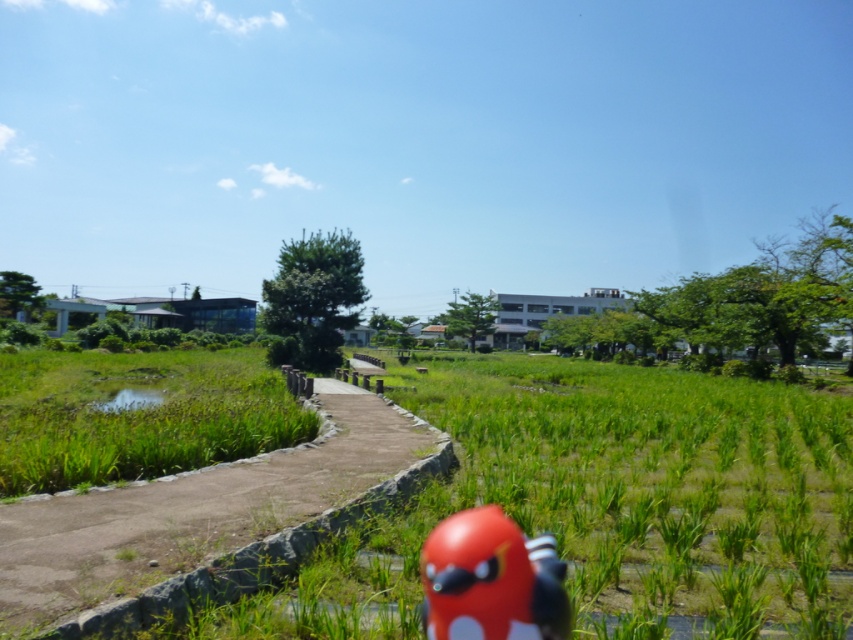
Question: Is smooth concrete path at center smaller than shiny red toy at center?

Choices:
 (A) no
 (B) yes

Answer: (A)

Question: Among these points, which one is nearest to the camera?

Choices:
 (A) (55, 570)
 (B) (440, 628)

Answer: (B)

Question: Considering the relative positions of smooth concrete path at center and shiny red toy at center in the image provided, where is smooth concrete path at center located with respect to shiny red toy at center?

Choices:
 (A) left
 (B) right

Answer: (A)

Question: Can you confirm if smooth concrete path at center is thinner than shiny red toy at center?

Choices:
 (A) no
 (B) yes

Answer: (A)